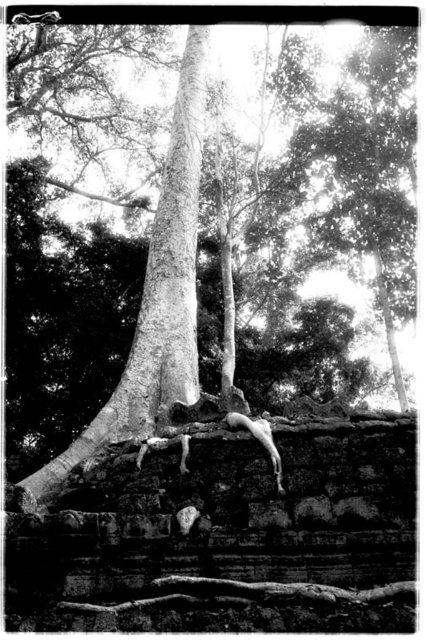
Based on the scene description, which object has a greater width between the smooth bark tree at center and the smooth bark tree trunk at center?

The smooth bark tree at center has a greater width than the smooth bark tree trunk at center according to the description.

Looking at this image, you are an archaeologist measuring the space between two parts of the tree. You need to know if there is enough space to place a 20 inch long measuring tape between the smooth bark tree at center and the smooth bark tree trunk at center. Can you fit the tape between them?

The distance between the smooth bark tree at center and the smooth bark tree trunk at center is 20.05 inches, which is slightly longer than the 20 inch measuring tape. Therefore, the tape can fit between them with a small amount of space to spare.